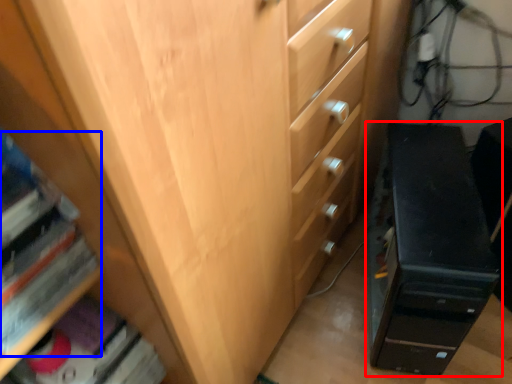
Question: Which object is closer to the camera taking this photo, chest of drawers (highlighted by a red box) or book (highlighted by a blue box)?

Choices:
 (A) chest of drawers
 (B) book

Answer: (B)